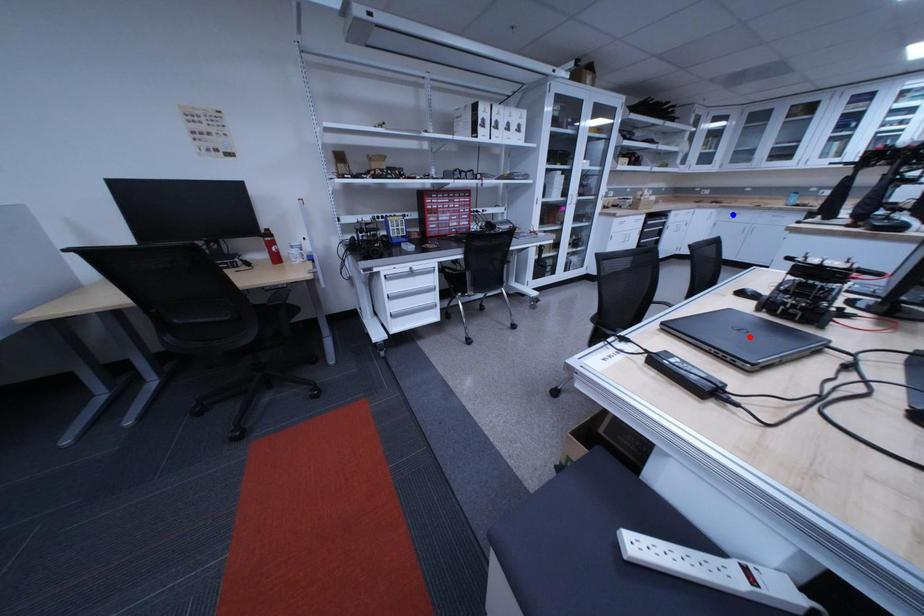
Question: In the image, two points are highlighted. Which point is nearer to the camera? Reply with the corresponding letter.

Choices:
 (A) blue point
 (B) red point

Answer: (B)